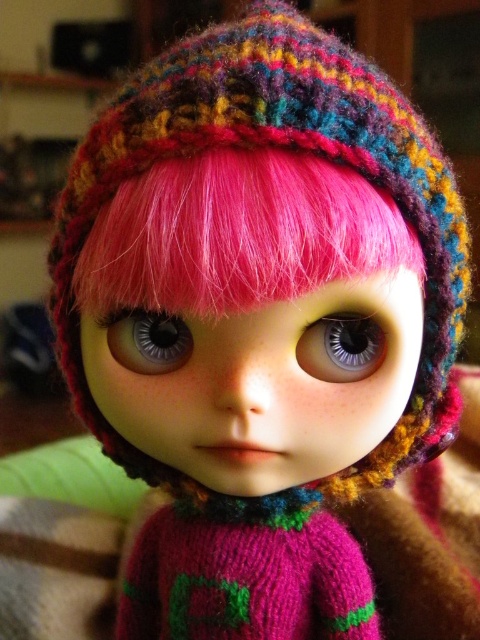
Question: Considering the relative positions of pink woolen hair at center and gray matte eye at center in the image provided, where is pink woolen hair at center located with respect to gray matte eye at center?

Choices:
 (A) above
 (B) below

Answer: (A)

Question: Does pink woolen hair at center have a larger size compared to shiny plastic eye at center?

Choices:
 (A) no
 (B) yes

Answer: (B)

Question: Which point is closer to the camera?

Choices:
 (A) pink woolen hair at center
 (B) gray matte eye at center
 (C) shiny plastic eye at center

Answer: (A)

Question: Is pink woolen hair at center bigger than gray matte eye at center?

Choices:
 (A) no
 (B) yes

Answer: (B)

Question: Among these objects, which one is nearest to the camera?

Choices:
 (A) pink woolen hair at center
 (B) gray matte eye at center

Answer: (A)

Question: Which object is the farthest from the pink woolen hair at center?

Choices:
 (A) gray matte eye at center
 (B) shiny plastic eye at center

Answer: (A)